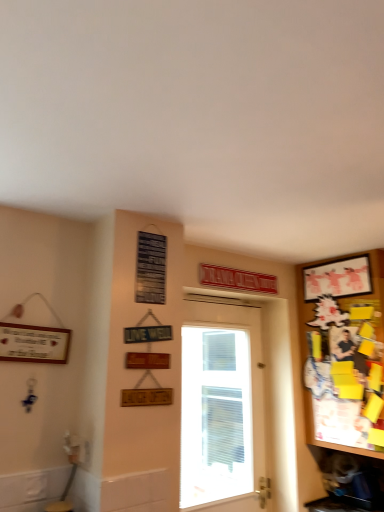
Question: Could you tell me if white glossy door at center is facing wooden bulletin board at right?

Choices:
 (A) no
 (B) yes

Answer: (A)

Question: Does white glossy door at center contain wooden bulletin board at right?

Choices:
 (A) no
 (B) yes

Answer: (A)

Question: Can you confirm if white glossy door at center is positioned to the left of wooden bulletin board at right?

Choices:
 (A) no
 (B) yes

Answer: (B)

Question: Is the position of white glossy door at center more distant than that of wooden bulletin board at right?

Choices:
 (A) yes
 (B) no

Answer: (A)

Question: Does white glossy door at center have a lesser width compared to wooden bulletin board at right?

Choices:
 (A) yes
 (B) no

Answer: (A)

Question: Considering the relative sizes of white glossy door at center and wooden bulletin board at right in the image provided, is white glossy door at center taller than wooden bulletin board at right?

Choices:
 (A) no
 (B) yes

Answer: (B)

Question: Are wooden bulletin board at right and matte white picture frame at upper right making contact?

Choices:
 (A) yes
 (B) no

Answer: (B)

Question: Does wooden bulletin board at right have a lesser height compared to matte white picture frame at upper right?

Choices:
 (A) yes
 (B) no

Answer: (B)

Question: Can you confirm if wooden bulletin board at right is taller than matte white picture frame at upper right?

Choices:
 (A) no
 (B) yes

Answer: (B)

Question: Is wooden bulletin board at right far from matte white picture frame at upper right?

Choices:
 (A) no
 (B) yes

Answer: (A)

Question: Considering the relative sizes of wooden bulletin board at right and matte white picture frame at upper right in the image provided, is wooden bulletin board at right wider than matte white picture frame at upper right?

Choices:
 (A) yes
 (B) no

Answer: (A)

Question: Is wooden bulletin board at right oriented towards matte white picture frame at upper right?

Choices:
 (A) yes
 (B) no

Answer: (B)

Question: Can you confirm if white glossy door at center is thinner than matte white picture frame at upper right?

Choices:
 (A) no
 (B) yes

Answer: (A)